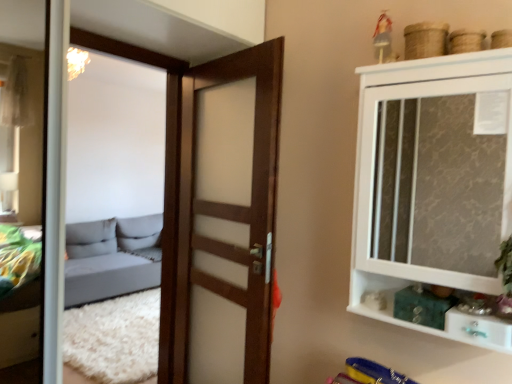
The image size is (512, 384). Describe the element at coordinates (479, 330) in the screenshot. I see `white glossy drawer at lower right` at that location.

Find the location of `wooden door at center`. wooden door at center is located at coordinates (192, 175).

Locate an element on the screen. This screenshot has height=384, width=512. white glossy drawer at lower right is located at coordinates (479, 330).

Can you confirm if white glossy cupboard at upper right is thinner than wooden door at center?

In fact, white glossy cupboard at upper right might be wider than wooden door at center.

Looking at this image, can you confirm if white glossy cupboard at upper right is smaller than wooden door at center?

Incorrect, white glossy cupboard at upper right is not smaller in size than wooden door at center.

Is the depth of white glossy cupboard at upper right less than that of wooden door at center?

Yes, the depth of white glossy cupboard at upper right is less than that of wooden door at center.

Could you tell me if white glossy cupboard at upper right is turned towards wooden door at center?

No.

Locate an element on the screen. cupboard to the left of white glossy drawer at lower right is located at coordinates (434, 185).

Could you tell me if white glossy cupboard at upper right is turned towards white glossy drawer at lower right?

Yes, white glossy cupboard at upper right is turned towards white glossy drawer at lower right.

Is white glossy cupboard at upper right completely or partially outside of white glossy drawer at lower right?

Indeed, white glossy cupboard at upper right is completely outside white glossy drawer at lower right.

Does white glossy cupboard at upper right appear on the left side of white glossy drawer at lower right?

Correct, you'll find white glossy cupboard at upper right to the left of white glossy drawer at lower right.

Considering the positions of point (223, 60) and point (485, 316), is point (223, 60) closer or farther from the camera than point (485, 316)?

Point (223, 60) appears to be farther away from the viewer than point (485, 316).

Consider the image. Which is more to the left, wooden door at center or white glossy drawer at lower right?

wooden door at center.

Is wooden door at center taller than white glossy drawer at lower right?

Yes.

From the image's perspective, which object appears higher, wooden door at center or white glossy drawer at lower right?

wooden door at center, from the image's perspective.

Are wooden door at center and white glossy cupboard at upper right far apart?

They are positioned close to each other.

From a real-world perspective, between wooden door at center and white glossy cupboard at upper right, who is vertically higher?

In real-world perspective, white glossy cupboard at upper right is above.

Would you say white glossy cupboard at upper right is part of wooden door at center's contents?

No, wooden door at center does not contain white glossy cupboard at upper right.

Based on the photo, does white glossy drawer at lower right touch white glossy cupboard at upper right?

white glossy drawer at lower right and white glossy cupboard at upper right are clearly separated.

Which of these two, white glossy drawer at lower right or white glossy cupboard at upper right, is bigger?

With larger size is white glossy cupboard at upper right.

From the image's perspective, is white glossy drawer at lower right located beneath white glossy cupboard at upper right?

Yes, from the image's perspective, white glossy drawer at lower right is below white glossy cupboard at upper right.

In the scene shown: Which object is further away from the camera, white glossy drawer at lower right or wooden door at center?

wooden door at center.

Considering the sizes of objects white glossy drawer at lower right and wooden door at center in the image provided, who is thinner, white glossy drawer at lower right or wooden door at center?

Thinner between the two is wooden door at center.

Considering the sizes of objects white glossy drawer at lower right and wooden door at center in the image provided, who is taller, white glossy drawer at lower right or wooden door at center?

wooden door at center is taller.

Looking at this image, is white glossy drawer at lower right spatially inside wooden door at center, or outside of it?

white glossy drawer at lower right is not inside wooden door at center, it's outside.

At what (x,y) coordinates should I click in order to perform the action: click on cupboard that appears in front of the wooden door at center. Please return your answer as a coordinate pair (x, y). The width and height of the screenshot is (512, 384). Looking at the image, I should click on (434, 185).

Locate an element on the screen. The image size is (512, 384). cupboard located above the white glossy drawer at lower right (from a real-world perspective) is located at coordinates (434, 185).

From the image, which object appears to be farther from white glossy drawer at lower right, white glossy cupboard at upper right or wooden door at center?

Among the two, wooden door at center is located further to white glossy drawer at lower right.

From the image, which object appears to be nearer to white glossy cupboard at upper right, wooden door at center or white glossy drawer at lower right?

Based on the image, white glossy drawer at lower right appears to be nearer to white glossy cupboard at upper right.

Considering their positions, is white glossy cupboard at upper right positioned closer to wooden door at center than white glossy drawer at lower right?

Based on the image, white glossy cupboard at upper right appears to be nearer to wooden door at center.

Looking at the image, which one is located closer to wooden door at center, white glossy drawer at lower right or white glossy cupboard at upper right?

The object closer to wooden door at center is white glossy cupboard at upper right.

Based on their spatial positions, is wooden door at center or white glossy cupboard at upper right further from white glossy drawer at lower right?

wooden door at center lies further to white glossy drawer at lower right than the other object.

From the image, which object appears to be nearer to white glossy cupboard at upper right, white glossy drawer at lower right or wooden door at center?

The object closer to white glossy cupboard at upper right is white glossy drawer at lower right.

At what (x,y) coordinates should I click in order to perform the action: click on cupboard between wooden door at center and white glossy drawer at lower right. Please return your answer as a coordinate pair (x, y). Looking at the image, I should click on 434,185.